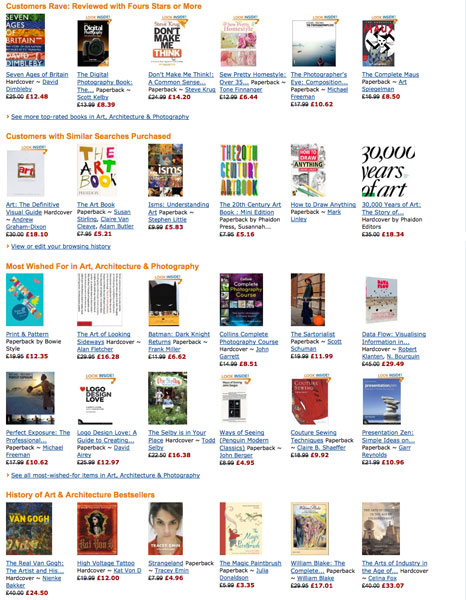
Identify the location of columns in the middle. The image size is (466, 600). (238, 529), (172, 525), (242, 397), (167, 403), (251, 301), (169, 305), (246, 165), (172, 171), (247, 40), (169, 46).